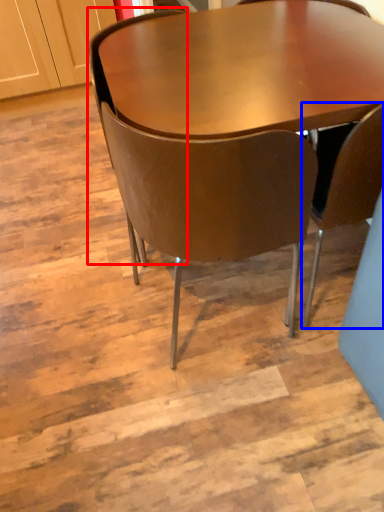
Question: Among these objects, which one is farthest to the camera, chair (highlighted by a red box) or chair (highlighted by a blue box)?

Choices:
 (A) chair
 (B) chair

Answer: (A)